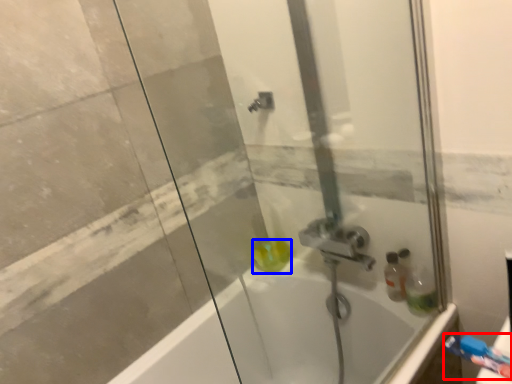
Question: Which object appears closest to the camera in this image, toiletry (highlighted by a red box) or liquid (highlighted by a blue box)?

Choices:
 (A) toiletry
 (B) liquid

Answer: (A)